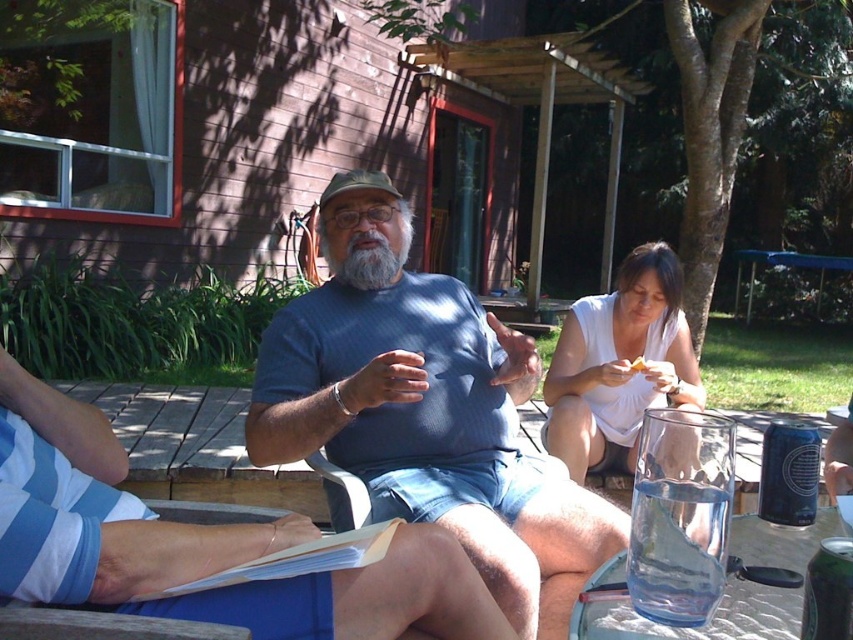
Question: Among these points, which one is nearest to the camera?

Choices:
 (A) (641, 360)
 (B) (308, 516)
 (C) (508, 602)
 (D) (599, 577)

Answer: (D)

Question: Which of the following is the closest to the observer?

Choices:
 (A) white paper at center
 (B) white cotton dress at lower right
 (C) clear glass picnic table at lower right
 (D) blue textured shirt at center

Answer: (C)

Question: Among these objects, which one is farthest from the camera?

Choices:
 (A) clear glass picnic table at lower right
 (B) white paper at center

Answer: (B)

Question: Does white cotton dress at lower right come behind clear glass picnic table at lower right?

Choices:
 (A) no
 (B) yes

Answer: (B)

Question: Is clear glass picnic table at lower right above white paper at center?

Choices:
 (A) yes
 (B) no

Answer: (B)

Question: Can you confirm if blue textured shirt at center is positioned to the left of clear glass picnic table at lower right?

Choices:
 (A) no
 (B) yes

Answer: (B)